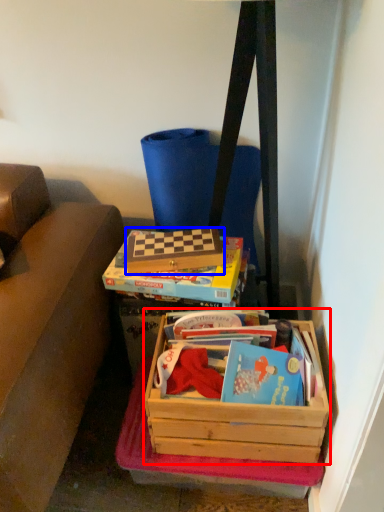
Question: Among these objects, which one is farthest to the camera, box (highlighted by a red box) or box (highlighted by a blue box)?

Choices:
 (A) box
 (B) box

Answer: (B)